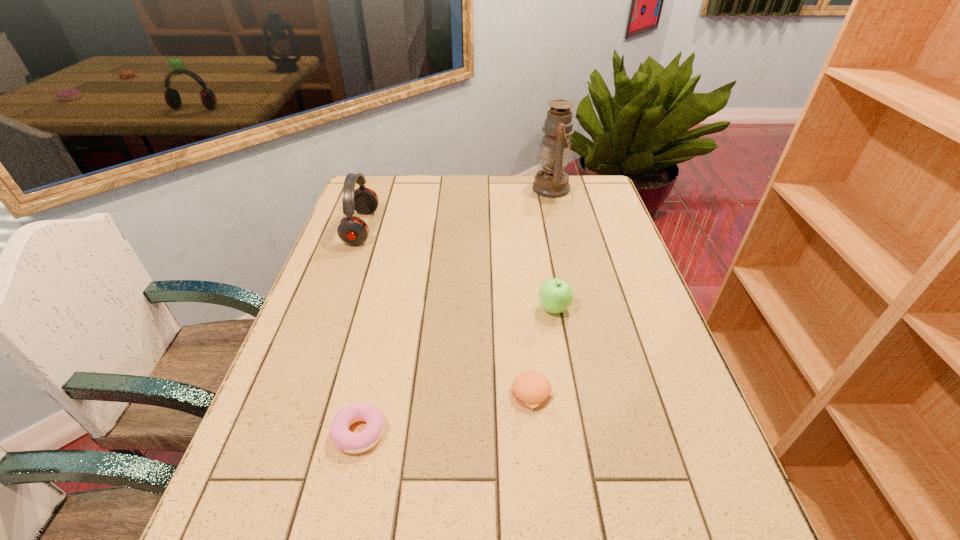
At what (x,y) coordinates should I click in order to perform the action: click on vacant space located on the front of the third nearest object. Please return your answer as a coordinate pair (x, y). Looking at the image, I should click on (570, 400).

The image size is (960, 540). I want to click on free point located 0.080m on the back of the patty, so click(x=527, y=347).

This screenshot has width=960, height=540. Identify the location of free location located on the right of the fourth object from right to left. (551, 433).

This screenshot has width=960, height=540. In order to click on oil lamp located at the far edge in this screenshot , I will do `click(552, 182)`.

Where is `earphone at the far edge`? The image size is (960, 540). earphone at the far edge is located at coordinates (352, 230).

The height and width of the screenshot is (540, 960). What are the coordinates of `earphone that is at the left edge` in the screenshot? It's located at (352, 230).

The image size is (960, 540). In order to click on pastry at the left edge in this screenshot , I will do `click(347, 441)`.

Locate an element on the screen. object that is at the right edge is located at coordinates (552, 182).

Where is `object that is at the far left corner`? This screenshot has width=960, height=540. object that is at the far left corner is located at coordinates (352, 230).

Find the location of a particular element. The image size is (960, 540). object that is at the far right corner is located at coordinates (552, 182).